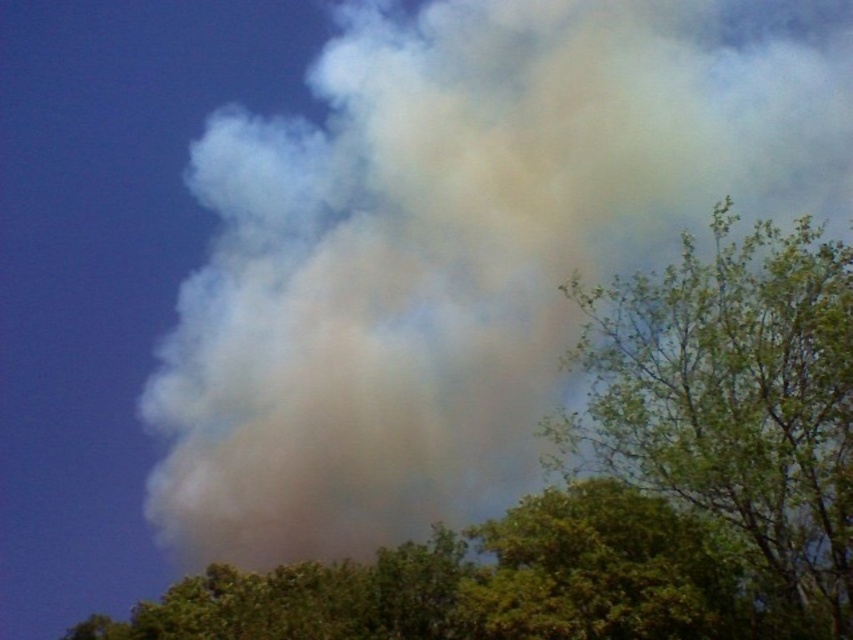
Which is in front, point (700, 292) or point (682, 554)?

Point (682, 554) is more forward.

Is green leafy tree at upper right to the left of green leafy tree at lower center from the viewer's perspective?

Incorrect, green leafy tree at upper right is not on the left side of green leafy tree at lower center.

Is point (578, 435) positioned after point (502, 634)?

That is True.

Identify the location of green leafy tree at upper right. (732, 403).